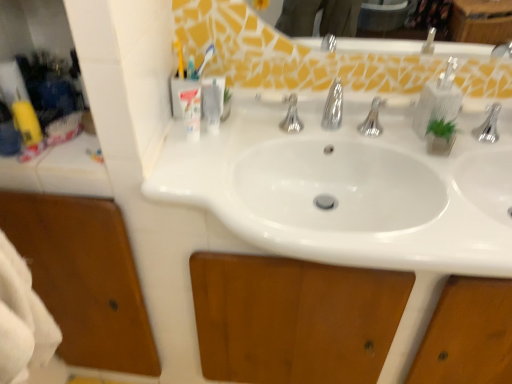
Locate an element on the screen. This screenshot has height=384, width=512. vacant space situated on the left part of clear plastic soap dispenser at upper right is located at coordinates (372, 134).